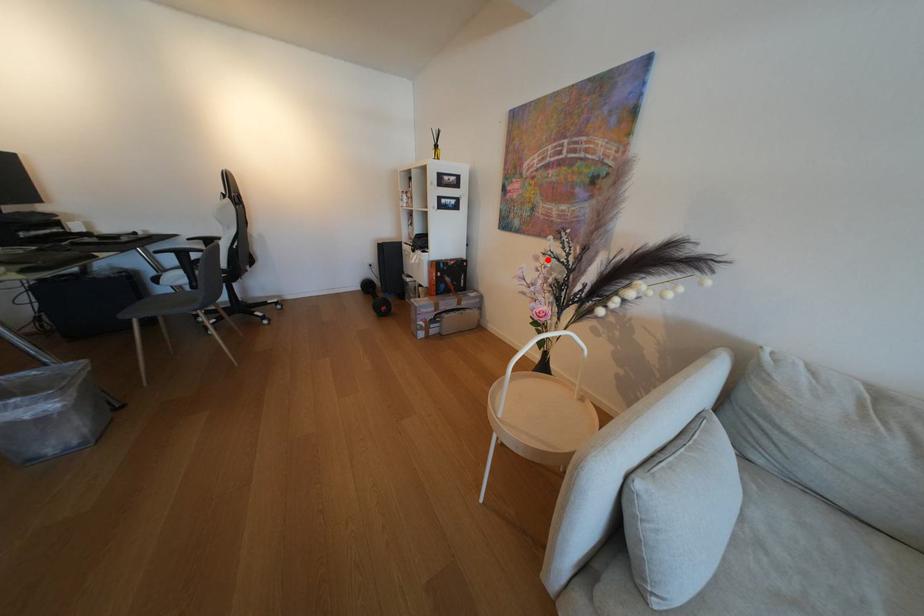
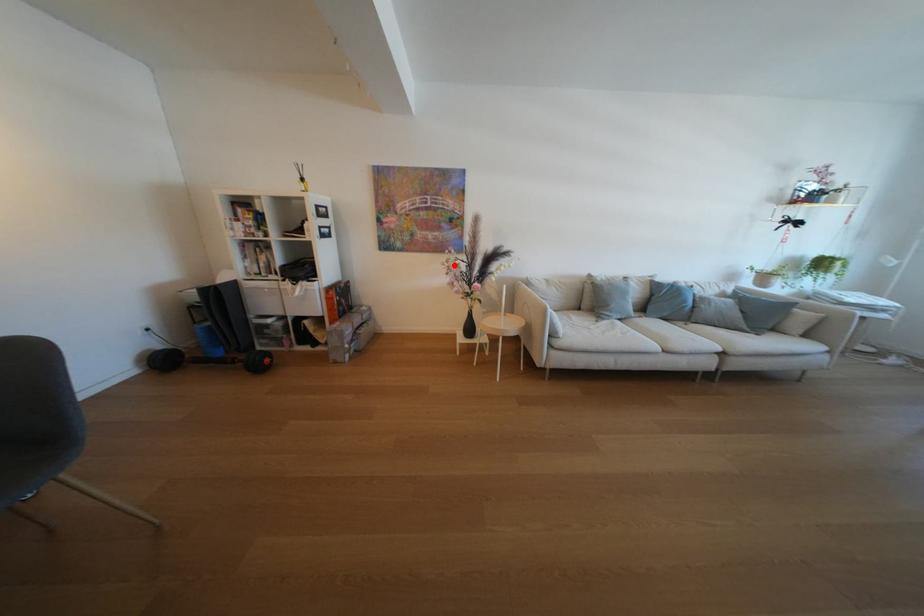
I am providing you with two images of the same scene from different viewpoints. A red point is marked on the first image and another point is marked on the second image. Are the points marked in image1 and image2 representing the same 3D position?

Yes